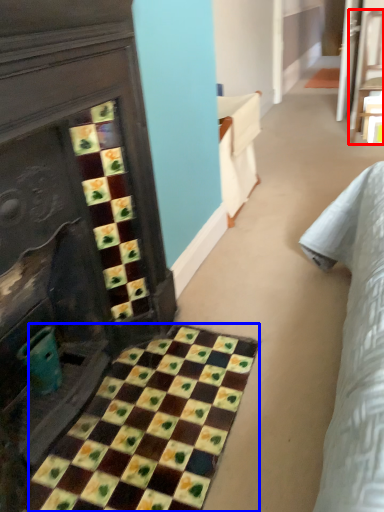
Question: Which point is closer to the camera, furniture (highlighted by a red box) or ceramic tile (highlighted by a blue box)?

Choices:
 (A) furniture
 (B) ceramic tile

Answer: (B)